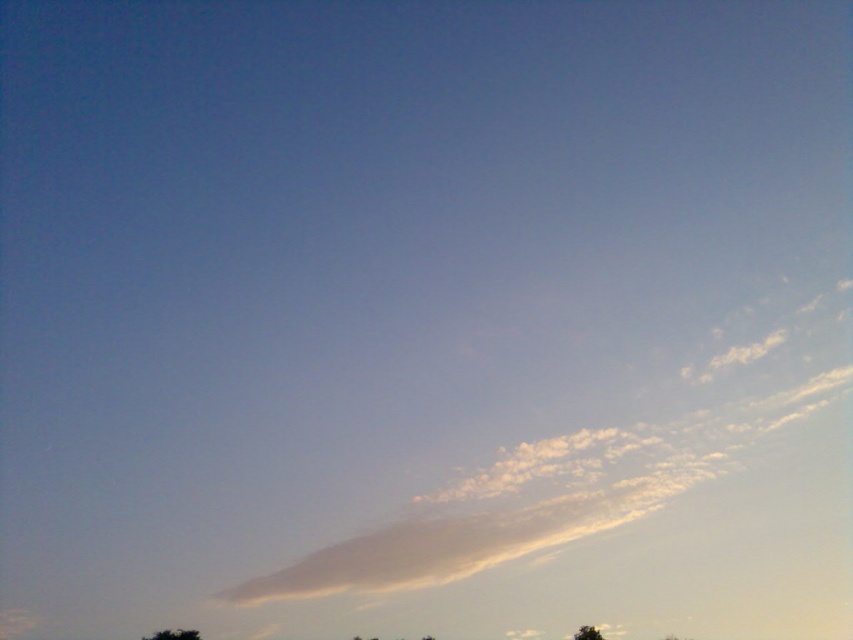
Who is lower down, green leafy tree at lower center or green leafy tree at lower right?

Positioned lower is green leafy tree at lower right.

Which is more to the left, green leafy tree at lower center or green leafy tree at lower right?

green leafy tree at lower center is more to the left.

Locate an element on the screen. This screenshot has width=853, height=640. green leafy tree at lower center is located at coordinates (173, 634).

Can you confirm if white fluffy cloud at center is positioned to the left of green leafy tree at lower right?

Indeed, white fluffy cloud at center is positioned on the left side of green leafy tree at lower right.

Between point (445, 493) and point (593, 634), which one is positioned in front?

Point (593, 634)

What are the coordinates of `white fluffy cloud at center` in the screenshot? It's located at 543,497.

Is white fluffy cloud at center below green leafy tree at lower center?

No.

Does white fluffy cloud at center appear on the left side of green leafy tree at lower center?

In fact, white fluffy cloud at center is to the right of green leafy tree at lower center.

Between point (670, 454) and point (193, 636), which one is positioned in front?

Positioned in front is point (193, 636).

Locate an element on the screen. The width and height of the screenshot is (853, 640). white fluffy cloud at center is located at coordinates (543, 497).